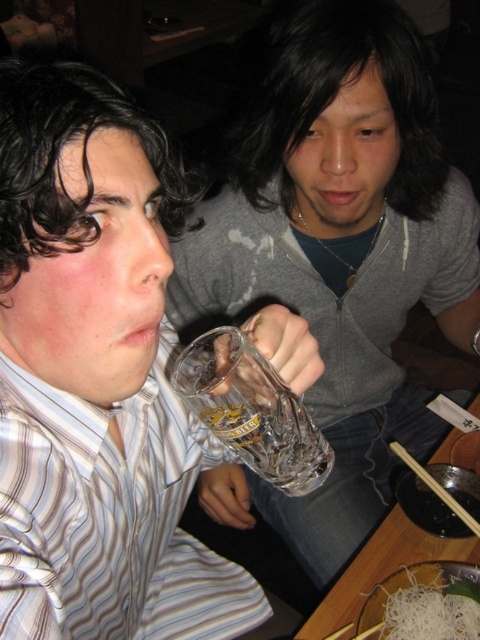
Question: Observing the image, what is the correct spatial positioning of clear glass bowl at lower right in reference to white noodle at lower right?

Choices:
 (A) above
 (B) below

Answer: (A)

Question: Which point is closer to the camera taking this photo?

Choices:
 (A) (355, 534)
 (B) (326, 611)
 (C) (399, 448)
 (D) (456, 570)

Answer: (D)

Question: Which point is farther to the camera?

Choices:
 (A) clear glass bowl at lower right
 (B) wooden chopsticks at lower right
 (C) clear glass mug at left

Answer: (B)

Question: Does transparent glass mug at upper center appear on the left side of clear glass beer at center?

Choices:
 (A) yes
 (B) no

Answer: (B)

Question: Is clear glass mug at left positioned before clear glass beer at center?

Choices:
 (A) yes
 (B) no

Answer: (A)

Question: Which point appears closest to the camera in this image?

Choices:
 (A) (393, 234)
 (B) (398, 582)

Answer: (B)